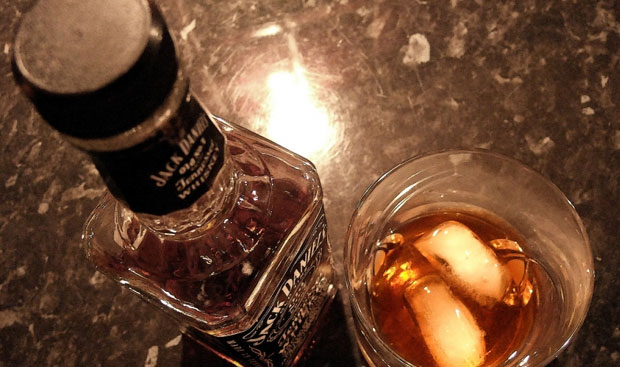
The image size is (620, 367). Find the location of `marble`. marble is located at coordinates (412, 51).